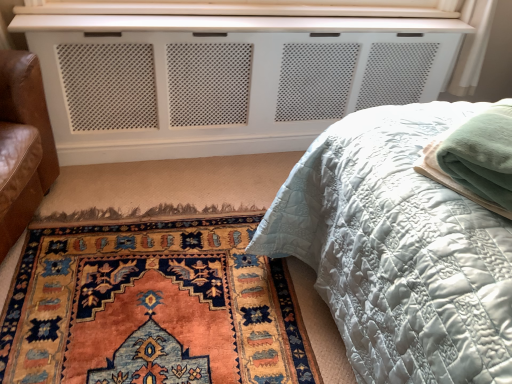
Find the location of a particular element. free space above white perforated panel at upper center (from a real-world perspective) is located at coordinates (237, 19).